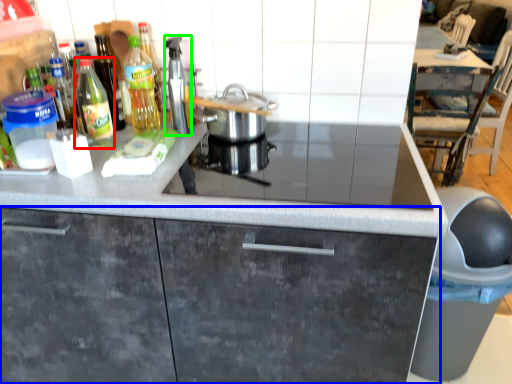
Question: Which object is the closest to the kitchen appliance (highlighted by a red box)? Choose among these: cabinetry (highlighted by a blue box) or kitchen appliance (highlighted by a green box).

Choices:
 (A) cabinetry
 (B) kitchen appliance

Answer: (B)